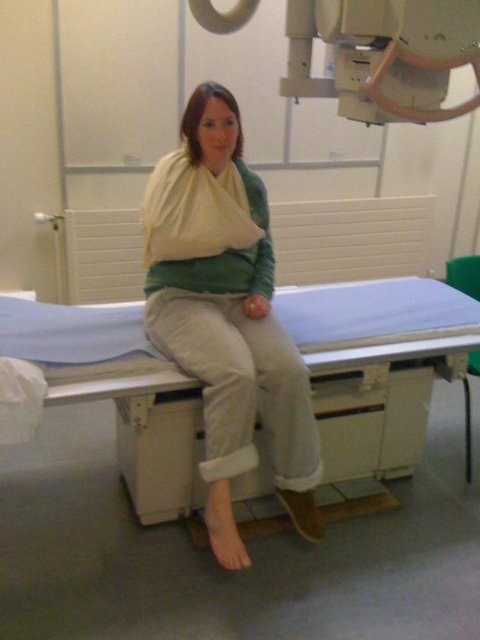
Question: Which object is farther from the camera taking this photo?

Choices:
 (A) matte white arm sling at center
 (B) blue fabric hospital bed at center

Answer: (A)

Question: Observing the image, what is the correct spatial positioning of blue fabric hospital bed at center in reference to matte white arm sling at center?

Choices:
 (A) below
 (B) above

Answer: (A)

Question: Is blue fabric hospital bed at center smaller than matte white arm sling at center?

Choices:
 (A) no
 (B) yes

Answer: (A)

Question: Does blue fabric hospital bed at center come behind matte white arm sling at center?

Choices:
 (A) no
 (B) yes

Answer: (A)

Question: Which point is closer to the camera?

Choices:
 (A) (219, 364)
 (B) (357, 352)

Answer: (A)